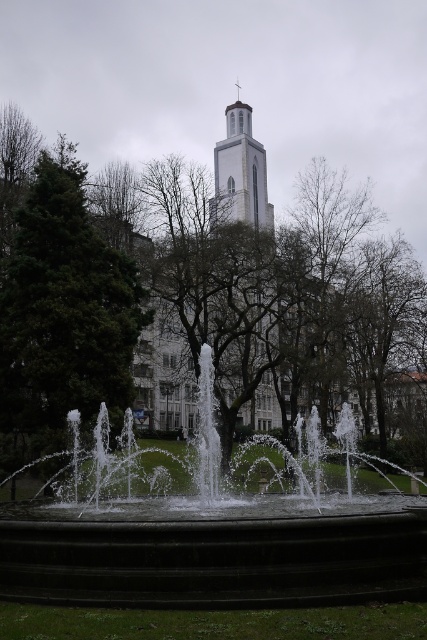
You are standing at the point marked by the coordinate point at (216, 561) in the image. Looking around, you see the white stone fountain at center. Which direction should you face to look towards the tall white building with a tower and cross on top?

The point at (216, 561) marks the location of the white stone fountain at center. Since the tall white building with a tower and cross is in the background, you should face away from the fountain towards the background to look towards the building.